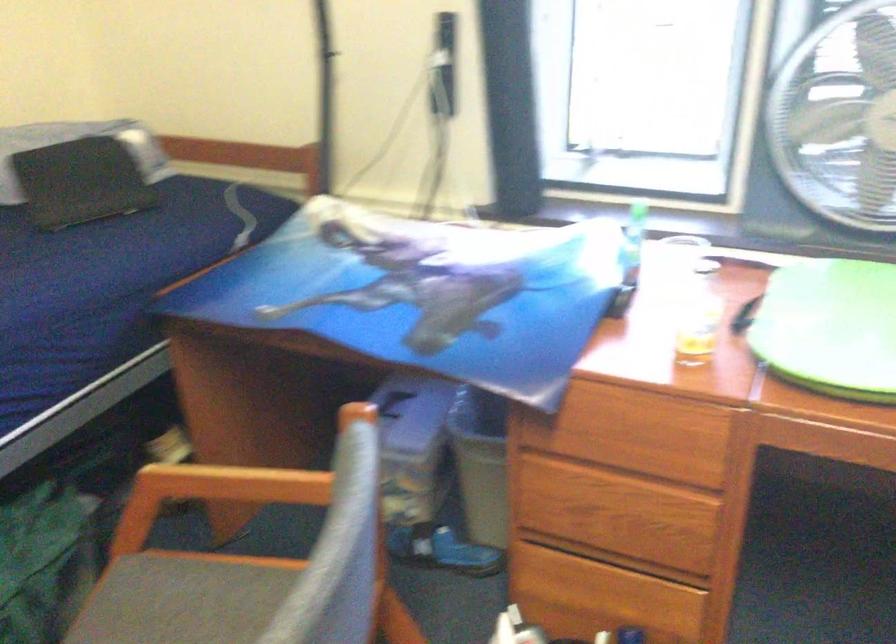
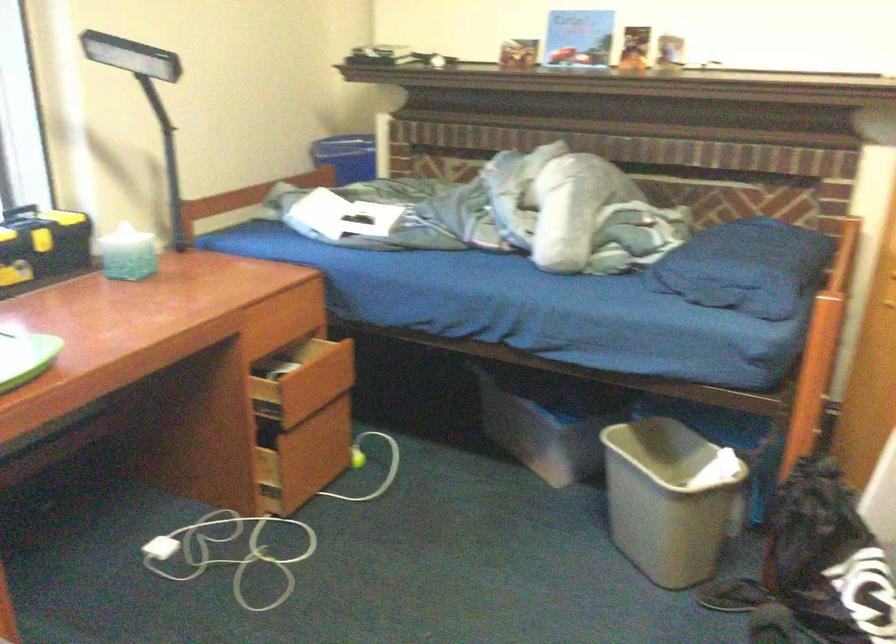
From the picture: First-person continuous shooting, in which direction is the camera rotating?

The camera's rotation is toward right-down.